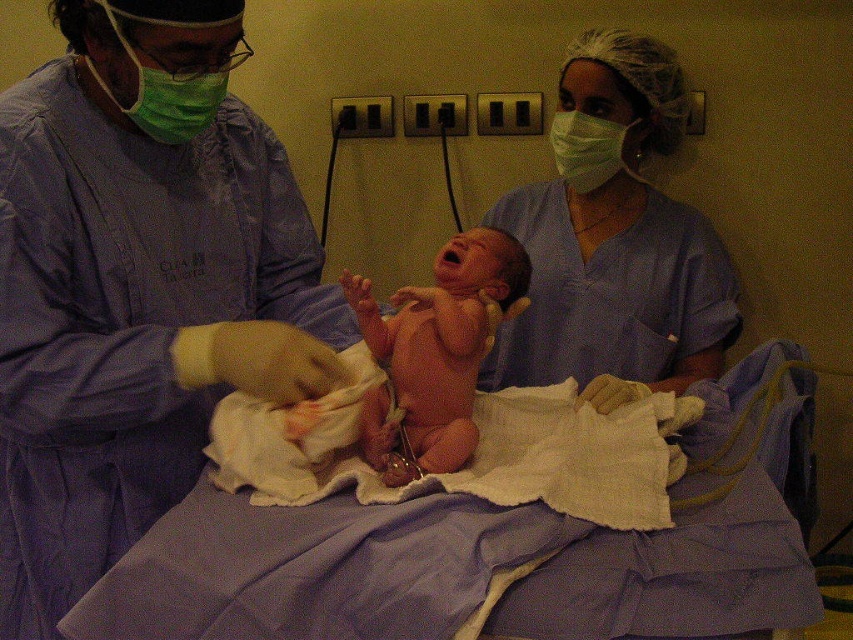
Is the position of smooth skin newborn at center less distant than that of green matte mask at upper center?

Yes, smooth skin newborn at center is closer to the viewer.

Is point (415, 385) in front of point (590, 180)?

Yes, it is in front of point (590, 180).

At what (x,y) coordinates should I click in order to perform the action: click on smooth skin newborn at center. Please return your answer as a coordinate pair (x, y). The image size is (853, 640). Looking at the image, I should click on (436, 349).

Does point (656, 236) come behind point (381, 412)?

Yes, point (656, 236) is farther from viewer.

The width and height of the screenshot is (853, 640). In order to click on matte blue scrubs at center in this screenshot , I will do `click(614, 241)`.

Does point (210, 275) lie in front of point (631, 156)?

Yes, point (210, 275) is in front of point (631, 156).

Who is more distant from viewer, (131,141) or (537,342)?

Positioned behind is point (537,342).

Who is more distant from viewer, (119, 124) or (578, 132)?

Point (578, 132)

I want to click on matte blue gown at center, so click(137, 285).